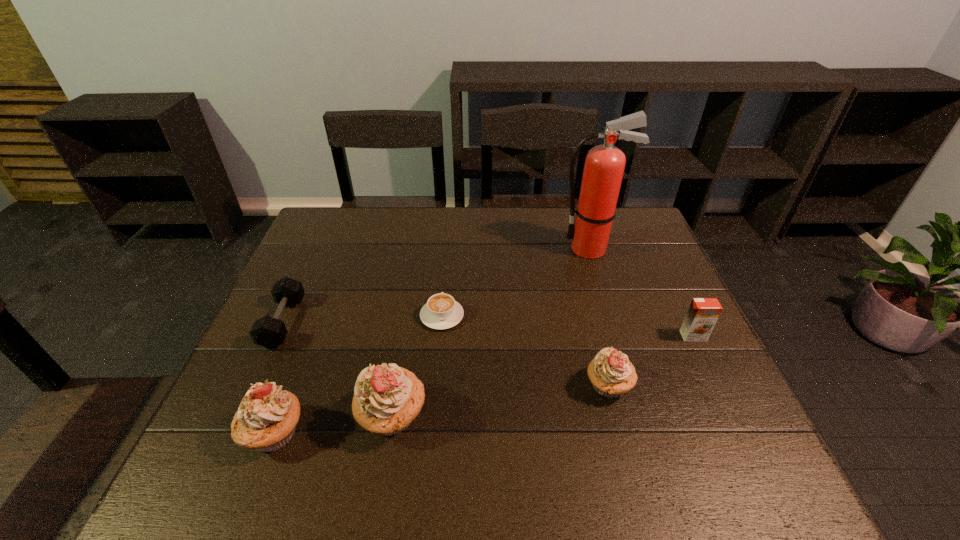
Where is `free space between the second cupcake from right to left and the sixth tallest object`? This screenshot has width=960, height=540. free space between the second cupcake from right to left and the sixth tallest object is located at coordinates (338, 369).

Where is `free area in between the dumbbell and the second shortest cupcake`? This screenshot has width=960, height=540. free area in between the dumbbell and the second shortest cupcake is located at coordinates (278, 377).

The width and height of the screenshot is (960, 540). In order to click on unoccupied area between the shortest object and the leftmost cupcake in this screenshot , I will do `click(358, 374)`.

Identify which object is the sixth closest to the fifth shortest object. Please provide its 2D coordinates. Your answer should be formatted as a tuple, i.e. [(x, y)], where the tuple contains the x and y coordinates of a point satisfying the conditions above.

[(703, 313)]

Locate an element on the screen. This screenshot has height=540, width=960. the second closest object to the second cupcake from right to left is located at coordinates (441, 311).

Choose which cupcake is the nearest neighbor to the third tallest object. Please provide its 2D coordinates. Your answer should be formatted as a tuple, i.e. [(x, y)], where the tuple contains the x and y coordinates of a point satisfying the conditions above.

[(387, 398)]

Identify which cupcake is the third nearest to the rightmost object. Please provide its 2D coordinates. Your answer should be formatted as a tuple, i.e. [(x, y)], where the tuple contains the x and y coordinates of a point satisfying the conditions above.

[(266, 419)]

Locate an element on the screen. The height and width of the screenshot is (540, 960). vacant space that satisfies the following two spatial constraints: 1. on the hose direction of the orange juice; 2. on the left side of the fire extinguisher is located at coordinates (616, 336).